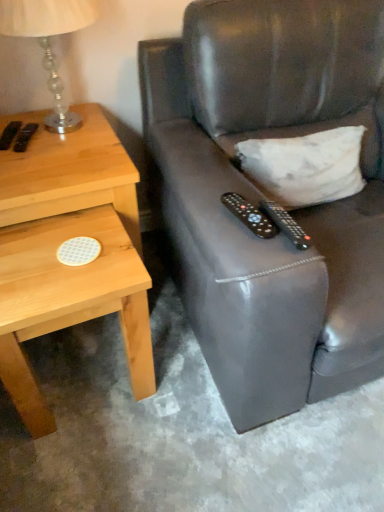
Locate an element on the screen. The width and height of the screenshot is (384, 512). empty space that is ontop of light wood/texture nightstand at left is located at coordinates 48,147.